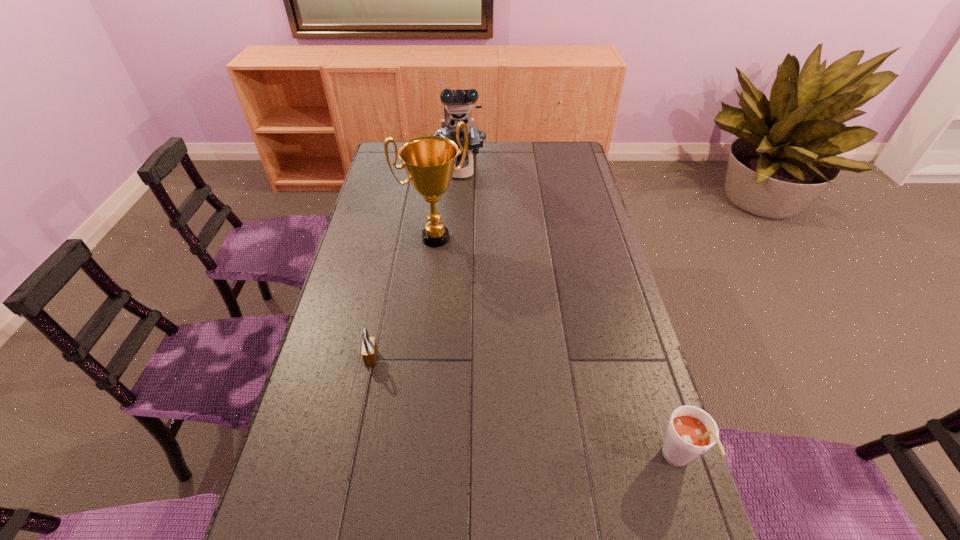
Locate an element on the screen. The height and width of the screenshot is (540, 960). empty location between the nearest object and the shortest object is located at coordinates (524, 409).

Identify the location of free spot between the nearest object and the shortest object. Image resolution: width=960 pixels, height=540 pixels. (524, 409).

Locate an element on the screen. object that stands as the third closest to the second shortest object is located at coordinates (457, 103).

The width and height of the screenshot is (960, 540). Find the location of `the closest object to the third tallest object`. the closest object to the third tallest object is located at coordinates (369, 353).